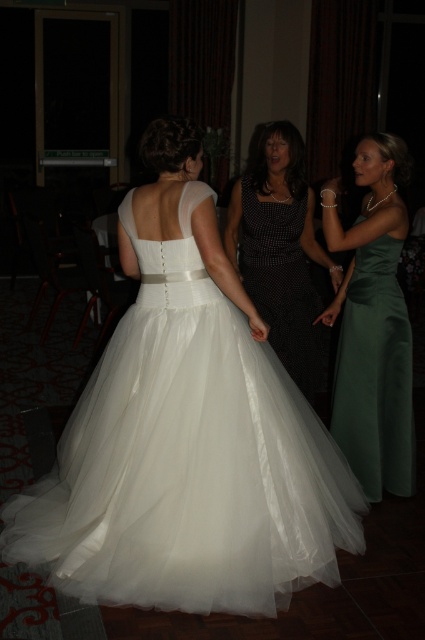
Question: Which of the following is the farthest from the observer?

Choices:
 (A) (289, 129)
 (B) (393, 284)
 (C) (190, 237)

Answer: (A)

Question: Does white tulle dress at center have a greater width compared to black dotted dress at center?

Choices:
 (A) no
 (B) yes

Answer: (B)

Question: Which object is positioned closest to the white tulle dress at center?

Choices:
 (A) black dotted dress at center
 (B) satin green dress at right

Answer: (B)

Question: From the image, what is the correct spatial relationship of satin green dress at right in relation to black dotted dress at center?

Choices:
 (A) above
 (B) below

Answer: (B)

Question: Does satin green dress at right have a lesser width compared to black dotted dress at center?

Choices:
 (A) yes
 (B) no

Answer: (A)

Question: Among these objects, which one is nearest to the camera?

Choices:
 (A) black dotted dress at center
 (B) satin green dress at right
 (C) white tulle dress at center

Answer: (C)